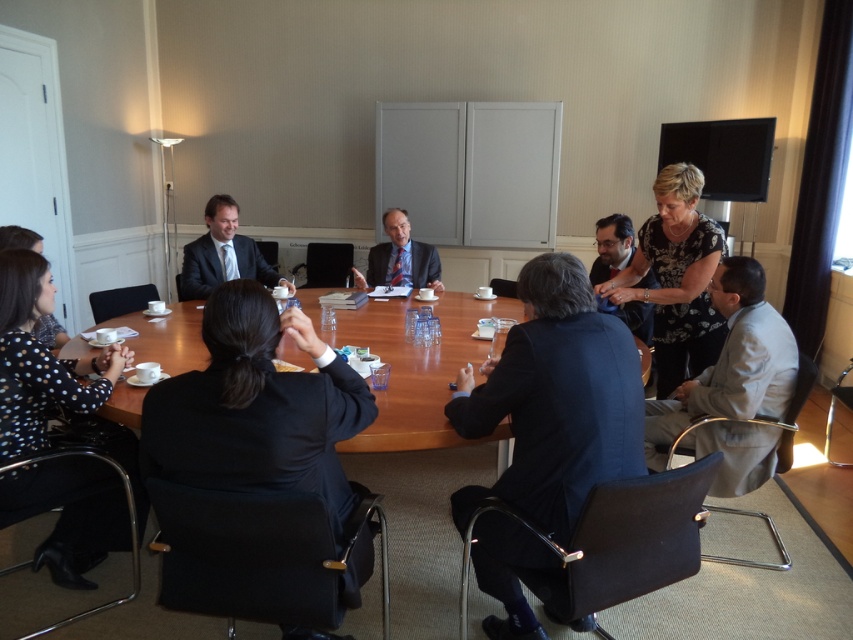
Is wooden table at center further to the viewer compared to matte blue suit at center?

No, wooden table at center is closer to the viewer.

Does wooden table at center have a smaller size compared to matte blue suit at center?

No.

What do you see at coordinates (412, 365) in the screenshot? I see `wooden table at center` at bounding box center [412, 365].

Where is `wooden table at center`? This screenshot has width=853, height=640. wooden table at center is located at coordinates (412, 365).

Can you confirm if wooden table at center is positioned to the left of light gray suit at lower right?

Yes, wooden table at center is to the left of light gray suit at lower right.

Does wooden table at center appear on the right side of light gray suit at lower right?

Incorrect, wooden table at center is not on the right side of light gray suit at lower right.

Measure the distance between wooden table at center and camera.

They are 1.90 meters apart.

You are a GUI agent. You are given a task and a screenshot of the screen. Output one action in this format:
    pyautogui.click(x=<x>, y=<y>)
    Task: Click on the wooden table at center
    This screenshot has height=640, width=853.
    Given the screenshot: What is the action you would take?
    pyautogui.click(x=412, y=365)

Does light gray suit at lower right appear over matte black suit at left?

No, light gray suit at lower right is not above matte black suit at left.

The image size is (853, 640). Identify the location of light gray suit at lower right. (730, 362).